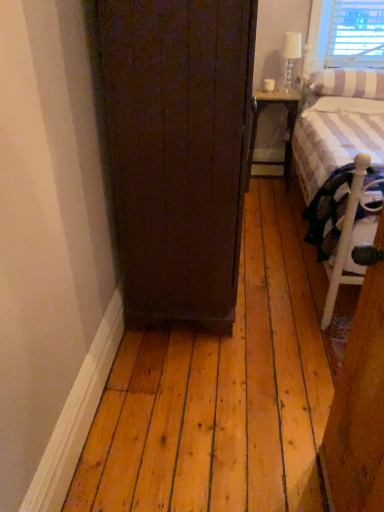
Where is `vacant area that lies in front of dark wood door at center`? This screenshot has height=512, width=384. vacant area that lies in front of dark wood door at center is located at coordinates (219, 380).